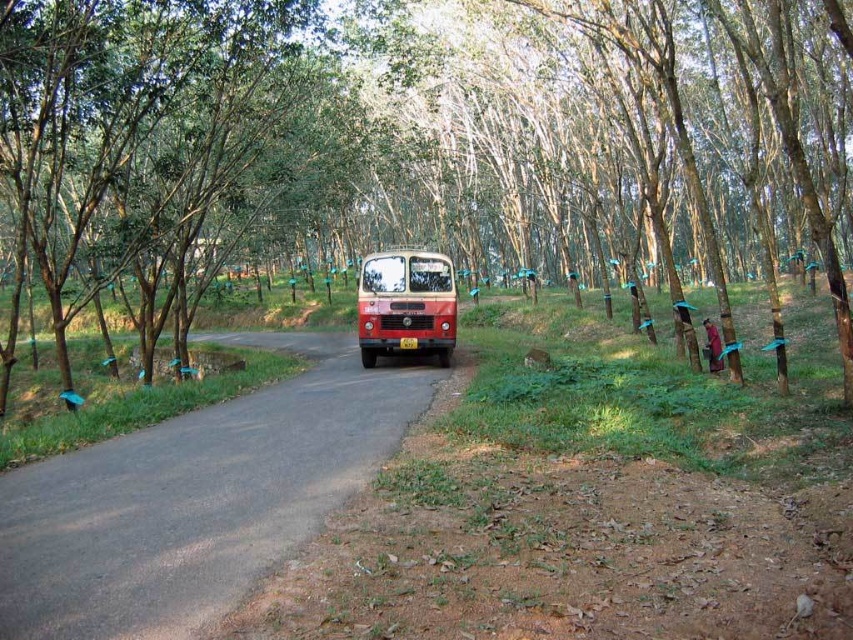
Who is more forward, (589, 168) or (57, 472)?

Point (57, 472) is in front.

Looking at this image, can you confirm if brown smooth tree at center is positioned below smooth asphalt road at center?

No.

This screenshot has width=853, height=640. Identify the location of brown smooth tree at center. (415, 148).

Consider the image. Is smooth asphalt road at center positioned at the back of matte red bus at center?

No.

Describe the element at coordinates (196, 499) in the screenshot. I see `smooth asphalt road at center` at that location.

What are the coordinates of `smooth asphalt road at center` in the screenshot? It's located at (196, 499).

Does brown smooth tree at center have a larger size compared to matte red bus at center?

Correct, brown smooth tree at center is larger in size than matte red bus at center.

Does brown smooth tree at center appear on the right side of matte red bus at center?

In fact, brown smooth tree at center is to the left of matte red bus at center.

Which is in front, point (525, 141) or point (410, 273)?

Point (410, 273) is more forward.

Image resolution: width=853 pixels, height=640 pixels. What are the coordinates of `brown smooth tree at center` in the screenshot? It's located at (415, 148).